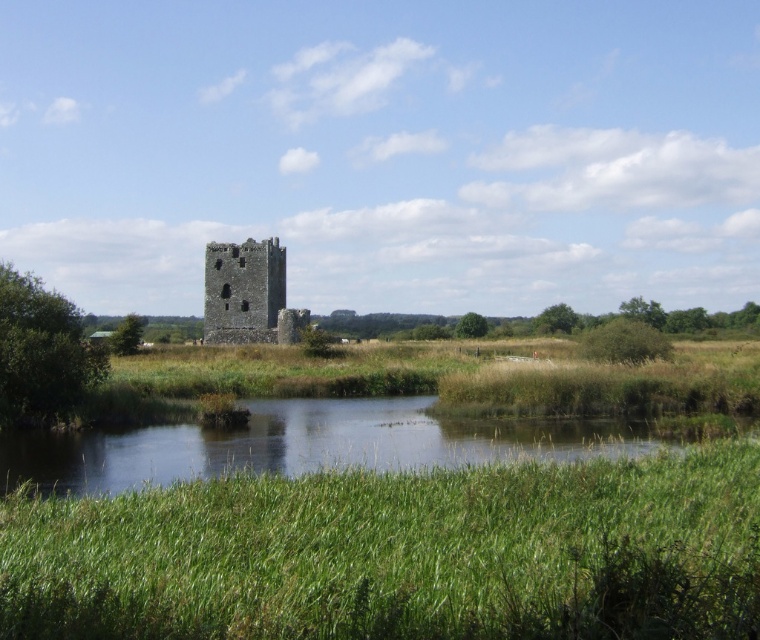
Between green grassy river at lower center and rustic stone tower at center, which one is positioned lower?

green grassy river at lower center is lower down.

Does green grassy river at lower center have a greater width compared to rustic stone tower at center?

Indeed, green grassy river at lower center has a greater width compared to rustic stone tower at center.

The width and height of the screenshot is (760, 640). What do you see at coordinates (306, 444) in the screenshot?
I see `green grassy river at lower center` at bounding box center [306, 444].

What are the coordinates of `green grassy river at lower center` in the screenshot? It's located at (306, 444).